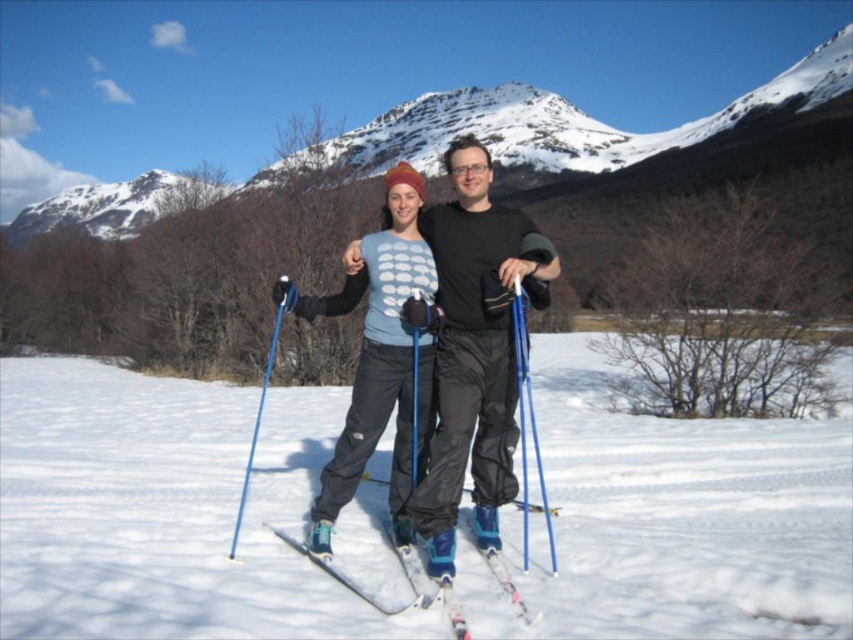
You are a photographer trying to capture a clear photo of the matte blue ski at center and the blue metallic ski pole at left. Based on their positions, which object is closer to the camera?

The matte blue ski at center is positioned under the blue metallic ski pole at left, so the blue metallic ski pole at left is closer to the camera.

You are planning to place a small flag at the point where the blue plastic ski pole at center is located. What are the coordinates of the point where you should place the flag?

The coordinates for placing the flag should be at point (529,424) where the blue plastic ski pole at center is located.

You are a photographer trying to capture a clear photo of the blue plastic ski pole at center and the blue metallic ski pole at left. Which pole will appear closer to the camera in the photo?

The blue plastic ski pole at center will appear closer to the camera because it is positioned in front of the blue metallic ski pole at left.